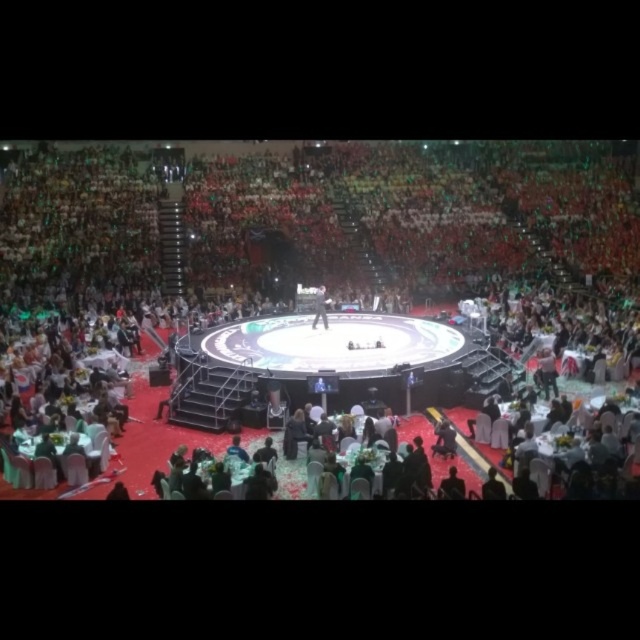
Who is more distant from viewer, (310, 157) or (320, 300)?

Positioned behind is point (310, 157).

Who is positioned more to the right, black glossy microphone at center or black fabric person at center?

black glossy microphone at center

From the picture: Who is more distant from viewer, [508,333] or [314,308]?

Positioned behind is point [314,308].

At what (x,y) coordinates should I click in order to perform the action: click on black glossy microphone at center. Please return your answer as a coordinate pair (x, y). Looking at the image, I should click on (301, 308).